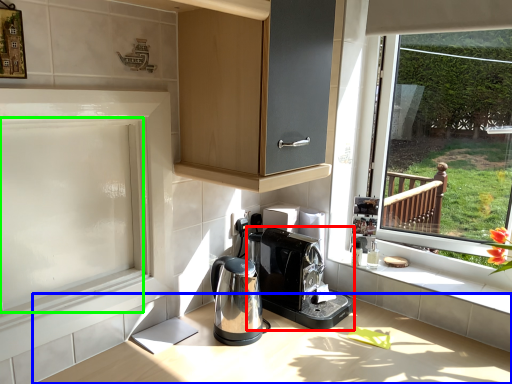
Question: Which object is positioned farthest from home appliance (highlighted by a red box)? Select from countertop (highlighted by a blue box) and screen door (highlighted by a green box).

Choices:
 (A) countertop
 (B) screen door

Answer: (B)